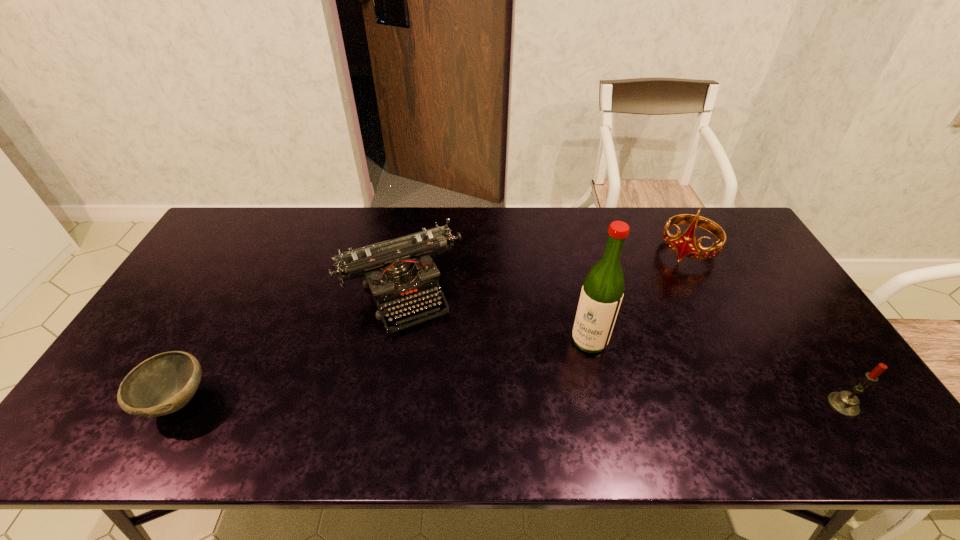
At what (x,y) coordinates should I click in order to perform the action: click on vacant space on the desktop that is between the bowl and the rightmost object and is positioned on the keyboard of the typewriter. Please return your answer as a coordinate pair (x, y). The image size is (960, 540). Looking at the image, I should click on (460, 403).

This screenshot has height=540, width=960. Identify the location of free spot on the desktop that is between the bowl and the candle and is positioned on the front-facing side of the fourth object from left to right. (581, 404).

Where is `free space on the desktop that is between the bowl and the rightmost object and is positioned on the label of the liquor`? free space on the desktop that is between the bowl and the rightmost object and is positioned on the label of the liquor is located at coordinates (544, 403).